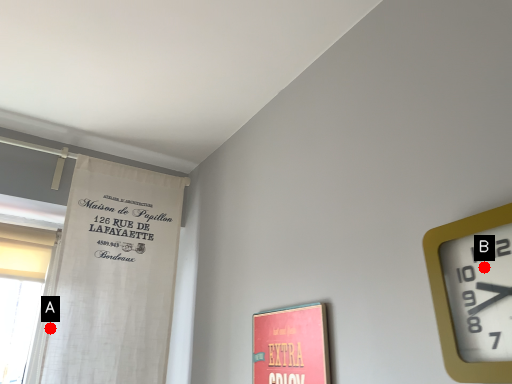
Question: Two points are circled on the image, labeled by A and B beside each circle. Which point is closer to the camera?

Choices:
 (A) A is closer
 (B) B is closer

Answer: (B)